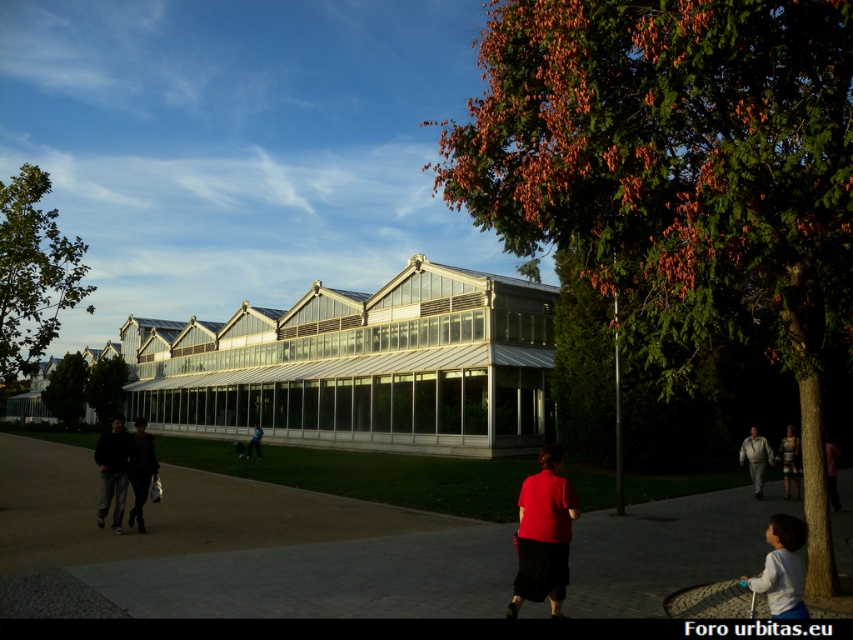
Question: Based on their relative distances, which object is farther from the striped fabric dress at lower right?

Choices:
 (A) gray concrete path at center
 (B) dark gray sweater at left

Answer: (B)

Question: Which of these objects is positioned closest to the green leafy tree at upper center?

Choices:
 (A) dark brown leather jacket at lower right
 (B) green leafy tree at center-left
 (C) light gray suit at lower right

Answer: (B)

Question: Does light gray suit at lower right appear on the right side of dark brown leather jacket at lower right?

Choices:
 (A) no
 (B) yes

Answer: (B)

Question: Is dark gray sweater at left thinner than dark brown leather jacket at lower right?

Choices:
 (A) no
 (B) yes

Answer: (B)

Question: Does gray concrete path at center have a larger size compared to striped fabric dress at lower right?

Choices:
 (A) no
 (B) yes

Answer: (B)

Question: Which object is closer to the camera taking this photo?

Choices:
 (A) matte red shirt at center
 (B) dark gray sweater at left
 (C) white cotton shirt at lower right

Answer: (C)